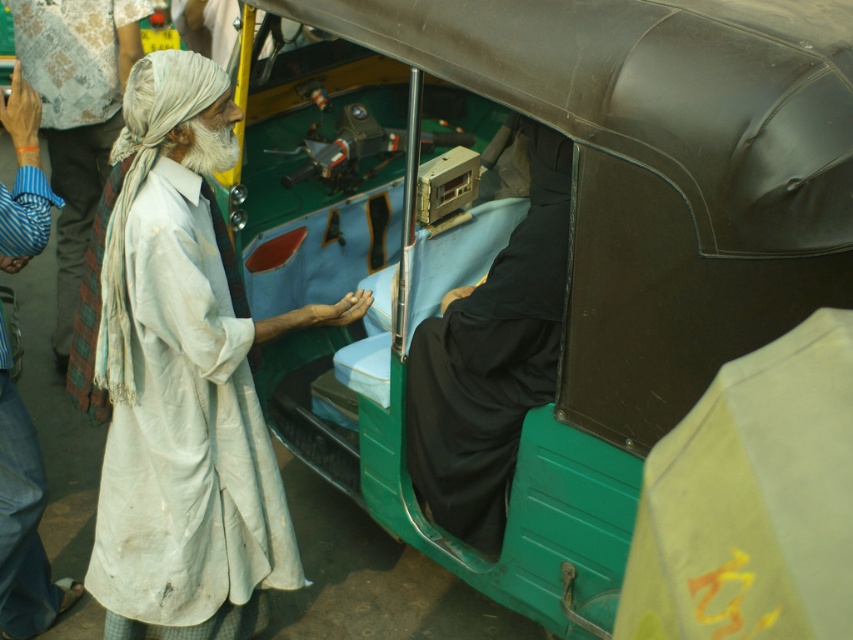
Who is shorter, green plastic motor vehicle at center or white cotton robe at left?

white cotton robe at left

Is point (631, 308) in front of point (16, 465)?

Yes, point (631, 308) is in front of point (16, 465).

Find the location of `green plastic motor vehicle at center`. green plastic motor vehicle at center is located at coordinates (558, 237).

The width and height of the screenshot is (853, 640). I want to click on green plastic motor vehicle at center, so click(x=558, y=237).

Is white cloth at left to the left of black matte robe at center from the viewer's perspective?

Correct, you'll find white cloth at left to the left of black matte robe at center.

Which is more to the left, white cloth at left or black matte robe at center?

white cloth at left

Does point (285, 502) come in front of point (547, 196)?

No.

At what (x,y) coordinates should I click in order to perform the action: click on white cloth at left. Please return your answer as a coordinate pair (x, y). Looking at the image, I should click on (187, 436).

Does green plastic motor vehicle at center have a lesser width compared to black matte robe at center?

No.

Does green plastic motor vehicle at center have a smaller size compared to black matte robe at center?

Incorrect, green plastic motor vehicle at center is not smaller in size than black matte robe at center.

Between point (802, 3) and point (534, 356), which one is positioned behind?

The point (534, 356) is more distant.

Find the location of a particular element. The width and height of the screenshot is (853, 640). green plastic motor vehicle at center is located at coordinates (558, 237).